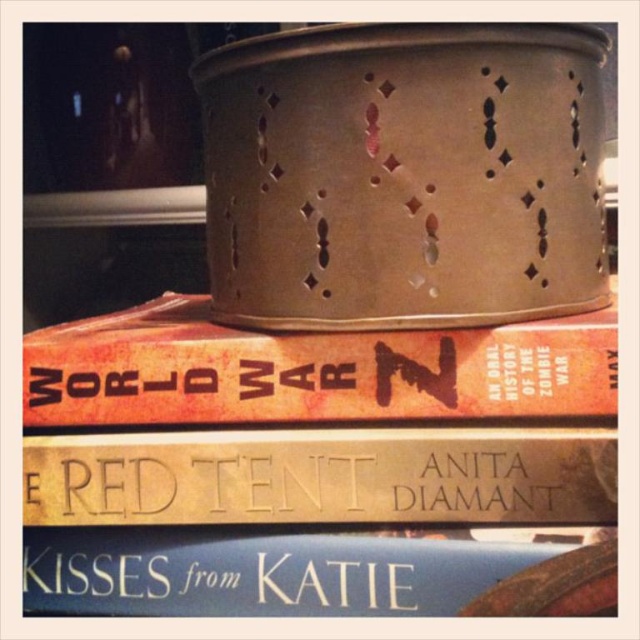
Does orange matte hardcover book at center lie behind blue matte book at lower center?

Yes, orange matte hardcover book at center is behind blue matte book at lower center.

Is orange matte hardcover book at center below blue matte book at lower center?

Actually, orange matte hardcover book at center is above blue matte book at lower center.

Between point (198, 388) and point (496, 588), which one is positioned in front?

Point (496, 588)

This screenshot has height=640, width=640. Identify the location of orange matte hardcover book at center. (310, 371).

Who is shorter, orange matte hardcover book at center or gold embossed book at center?

With less height is gold embossed book at center.

Image resolution: width=640 pixels, height=640 pixels. What are the coordinates of `orange matte hardcover book at center` in the screenshot? It's located at (310, 371).

What do you see at coordinates (323, 476) in the screenshot? The image size is (640, 640). I see `gold embossed book at center` at bounding box center [323, 476].

Can you confirm if gold embossed book at center is smaller than blue matte book at lower center?

Yes, gold embossed book at center is smaller than blue matte book at lower center.

The height and width of the screenshot is (640, 640). I want to click on gold embossed book at center, so click(323, 476).

Locate an element on the screen. The height and width of the screenshot is (640, 640). gold embossed book at center is located at coordinates (323, 476).